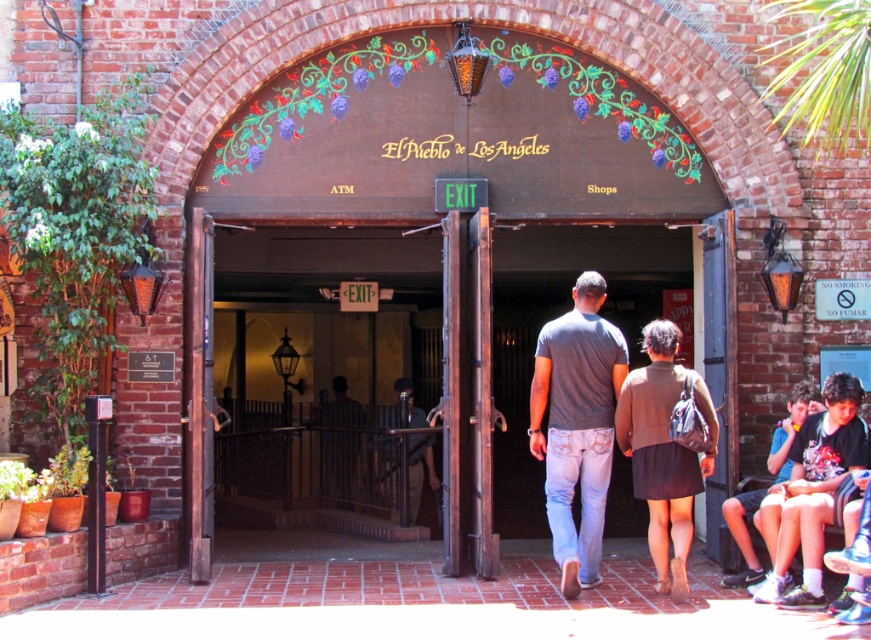
Looking at this image, you are standing at the entrance of El Pueblo de Los Angeles and see a gray cotton shirt at center and blue denim shorts at lower right. Which item is positioned more to the left side of the entrance?

The gray cotton shirt at center is positioned more to the left side of the entrance than the blue denim shorts at lower right.